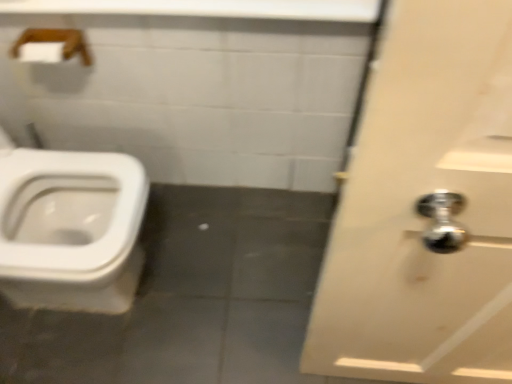
Question: Is white glossy door at right positioned far away from wooden towel bar at upper left?

Choices:
 (A) no
 (B) yes

Answer: (B)

Question: Is white glossy door at right bigger than wooden towel bar at upper left?

Choices:
 (A) no
 (B) yes

Answer: (B)

Question: Would you say white glossy door at right contains wooden towel bar at upper left?

Choices:
 (A) yes
 (B) no

Answer: (B)

Question: Considering the relative positions of white glossy door at right and wooden towel bar at upper left in the image provided, is white glossy door at right to the right of wooden towel bar at upper left from the viewer's perspective?

Choices:
 (A) yes
 (B) no

Answer: (A)

Question: Does white glossy door at right have a lesser width compared to wooden towel bar at upper left?

Choices:
 (A) no
 (B) yes

Answer: (B)

Question: Visually, is white glossy door at right positioned to the left or to the right of white glossy counter top at upper center?

Choices:
 (A) right
 (B) left

Answer: (A)

Question: From the image's perspective, is white glossy door at right positioned above or below white glossy counter top at upper center?

Choices:
 (A) above
 (B) below

Answer: (B)

Question: Is white glossy door at right wider or thinner than white glossy counter top at upper center?

Choices:
 (A) thin
 (B) wide

Answer: (A)

Question: Is white glossy door at right spatially inside white glossy counter top at upper center, or outside of it?

Choices:
 (A) inside
 (B) outside

Answer: (B)

Question: From the image's perspective, is white glossy counter top at upper center positioned above or below white glossy door at right?

Choices:
 (A) below
 (B) above

Answer: (B)

Question: Relative to white glossy door at right, is white glossy counter top at upper center in front or behind?

Choices:
 (A) behind
 (B) front

Answer: (A)

Question: From a real-world perspective, is white glossy counter top at upper center above or below white glossy door at right?

Choices:
 (A) below
 (B) above

Answer: (B)

Question: In terms of size, does white glossy counter top at upper center appear bigger or smaller than white glossy door at right?

Choices:
 (A) big
 (B) small

Answer: (B)

Question: Considering the positions of white glossy door at right and wooden towel bar at upper left in the image, is white glossy door at right taller or shorter than wooden towel bar at upper left?

Choices:
 (A) short
 (B) tall

Answer: (B)

Question: Considering the positions of white glossy door at right and wooden towel bar at upper left in the image, is white glossy door at right bigger or smaller than wooden towel bar at upper left?

Choices:
 (A) big
 (B) small

Answer: (A)